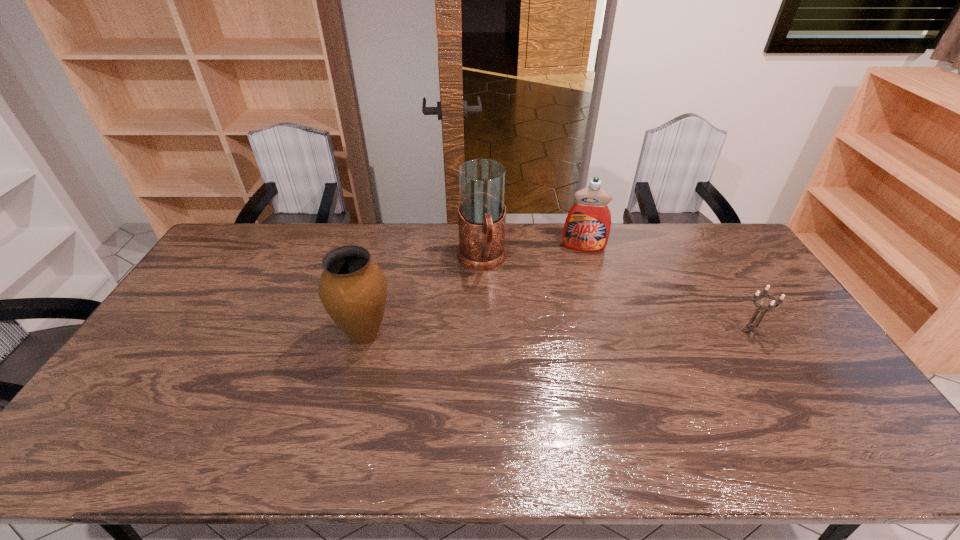
The width and height of the screenshot is (960, 540). In the image, there is a desktop. In order to click on free space at the right edge in this screenshot , I will do `click(723, 266)`.

Locate an element on the screen. Image resolution: width=960 pixels, height=540 pixels. free space at the far right corner of the desktop is located at coordinates (682, 224).

This screenshot has height=540, width=960. I want to click on blank region between the candle holder and the leftmost object, so click(x=557, y=333).

Locate an element on the screen. vacant area between the rightmost object and the second object from left to right is located at coordinates (615, 296).

This screenshot has height=540, width=960. I want to click on free point between the pitcher and the rightmost object, so click(x=615, y=296).

Find the location of `vacant space in between the third object from right to left and the urn`. vacant space in between the third object from right to left and the urn is located at coordinates (423, 297).

Find the location of a particular element. free space between the candle holder and the detergent is located at coordinates click(x=666, y=289).

Identify the location of vacant area that lies between the detergent and the rightmost object. (666, 289).

This screenshot has width=960, height=540. I want to click on free point between the detergent and the leftmost object, so click(474, 291).

You are a GUI agent. You are given a task and a screenshot of the screen. Output one action in this format:
    pyautogui.click(x=<x>, y=<y>)
    Task: Click on the vacant area that lies between the detergent and the shortest object
    This screenshot has height=540, width=960.
    Given the screenshot: What is the action you would take?
    pyautogui.click(x=666, y=289)